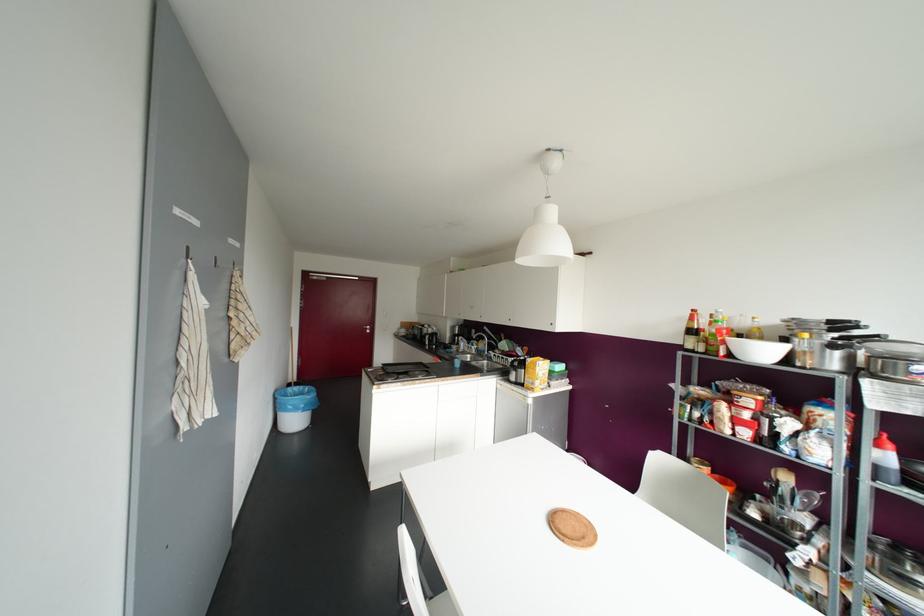
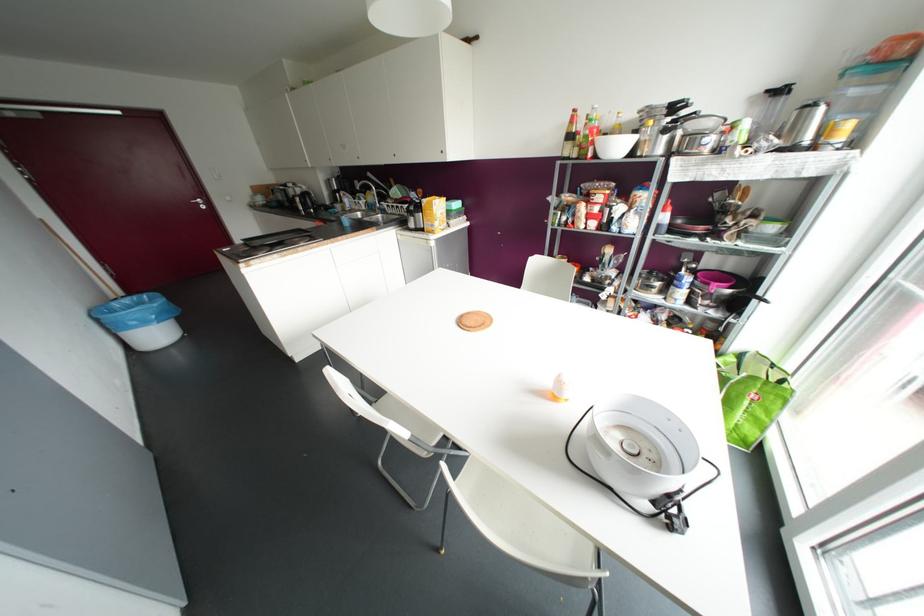
Locate, in the second image, the point that corresponds to (x=693, y=310) in the first image.

(574, 110)